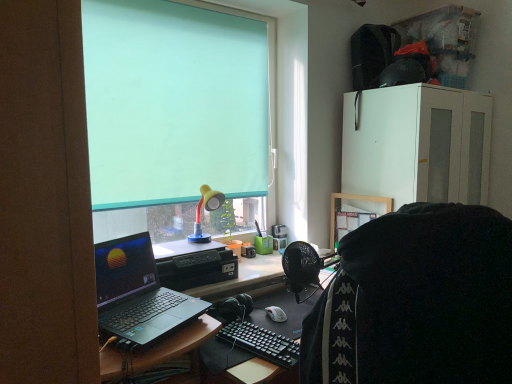
Question: Is teal matte/soft roller blind at upper center in front of black fabric at center?

Choices:
 (A) yes
 (B) no

Answer: (B)

Question: Does teal matte/soft roller blind at upper center have a smaller size compared to black fabric at center?

Choices:
 (A) yes
 (B) no

Answer: (A)

Question: Is teal matte/soft roller blind at upper center not within black fabric at center?

Choices:
 (A) no
 (B) yes

Answer: (B)

Question: Is teal matte/soft roller blind at upper center at the left side of black fabric at center?

Choices:
 (A) no
 (B) yes

Answer: (B)

Question: From a real-world perspective, is teal matte/soft roller blind at upper center beneath black fabric at center?

Choices:
 (A) yes
 (B) no

Answer: (B)

Question: Looking at the image, does black fabric at center seem bigger or smaller compared to yellow matte lamp at upper center?

Choices:
 (A) big
 (B) small

Answer: (A)

Question: Looking at their shapes, would you say black fabric at center is wider or thinner than yellow matte lamp at upper center?

Choices:
 (A) wide
 (B) thin

Answer: (A)

Question: From the image's perspective, relative to yellow matte lamp at upper center, is black fabric at center above or below?

Choices:
 (A) above
 (B) below

Answer: (B)

Question: Is black fabric at center situated inside yellow matte lamp at upper center or outside?

Choices:
 (A) outside
 (B) inside

Answer: (A)

Question: From a real-world perspective, relative to silver metallic laptop at left, is yellow matte lamp at upper center vertically above or below?

Choices:
 (A) above
 (B) below

Answer: (A)

Question: Considering the relative positions of yellow matte lamp at upper center and silver metallic laptop at left in the image provided, is yellow matte lamp at upper center to the left or to the right of silver metallic laptop at left?

Choices:
 (A) left
 (B) right

Answer: (B)

Question: In the image, is yellow matte lamp at upper center positioned in front of or behind silver metallic laptop at left?

Choices:
 (A) behind
 (B) front

Answer: (A)

Question: Considering the positions of point (197, 233) and point (137, 319), is point (197, 233) closer or farther from the camera than point (137, 319)?

Choices:
 (A) closer
 (B) farther

Answer: (B)

Question: Does point (217, 135) appear closer or farther from the camera than point (202, 203)?

Choices:
 (A) closer
 (B) farther

Answer: (B)

Question: Relative to yellow matte lamp at upper center, is teal matte/soft roller blind at upper center in front or behind?

Choices:
 (A) behind
 (B) front

Answer: (B)